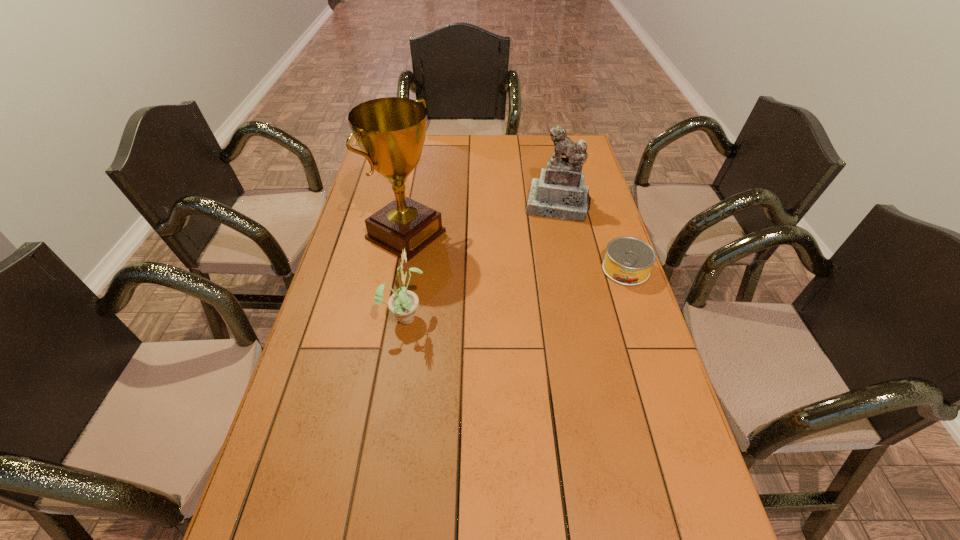
Find the location of `free space on the desktop that is between the nearest object and the can and is positioned on the plaque of the tallest object`. free space on the desktop that is between the nearest object and the can and is positioned on the plaque of the tallest object is located at coordinates (516, 293).

The image size is (960, 540). Identify the location of free space on the desktop that is between the nearest object and the can and is positioned on the front-facing side of the figurine. (543, 287).